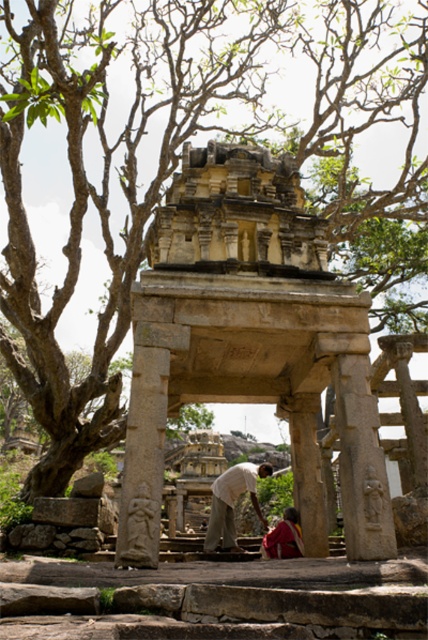
Question: Can you confirm if light brown cotton shirt at center is positioned below red fabric cloth at center?

Choices:
 (A) no
 (B) yes

Answer: (B)

Question: Which is nearer to the red fabric cloth at center?

Choices:
 (A) light brown cotton shirt at center
 (B) stone carved temple at center

Answer: (A)

Question: Does light brown cotton shirt at center have a lesser width compared to red fabric cloth at center?

Choices:
 (A) no
 (B) yes

Answer: (A)

Question: Which point is closer to the camera taking this photo?

Choices:
 (A) (276, 556)
 (B) (231, 468)

Answer: (A)

Question: Estimate the real-world distances between objects in this image. Which object is closer to the stone carved temple at center?

Choices:
 (A) red fabric cloth at center
 (B) light brown cotton shirt at center

Answer: (A)

Question: Does stone carved temple at center have a greater width compared to light brown cotton shirt at center?

Choices:
 (A) yes
 (B) no

Answer: (A)